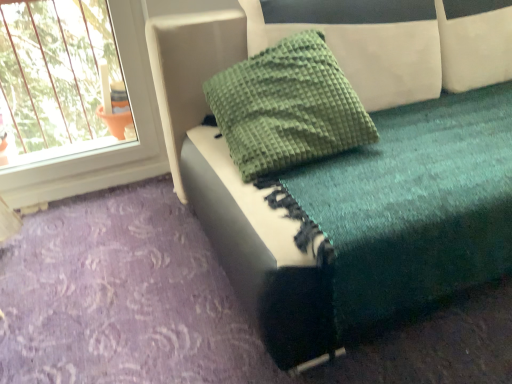
Question: Considering their positions, is green textured pillow at upper center located in front of or behind teal fabric cushion at upper center?

Choices:
 (A) front
 (B) behind

Answer: (B)

Question: Considering the positions of point (311, 140) and point (485, 109), is point (311, 140) closer or farther from the camera than point (485, 109)?

Choices:
 (A) farther
 (B) closer

Answer: (B)

Question: In terms of width, does green textured pillow at upper center look wider or thinner when compared to teal fabric cushion at upper center?

Choices:
 (A) thin
 (B) wide

Answer: (A)

Question: Is teal fabric cushion at upper center taller or shorter than green textured pillow at upper center?

Choices:
 (A) tall
 (B) short

Answer: (A)

Question: From a real-world perspective, is teal fabric cushion at upper center physically located above or below green textured pillow at upper center?

Choices:
 (A) above
 (B) below

Answer: (B)

Question: From the image's perspective, is teal fabric cushion at upper center above or below green textured pillow at upper center?

Choices:
 (A) below
 (B) above

Answer: (B)

Question: Visually, is teal fabric cushion at upper center positioned to the left or to the right of green textured pillow at upper center?

Choices:
 (A) left
 (B) right

Answer: (B)